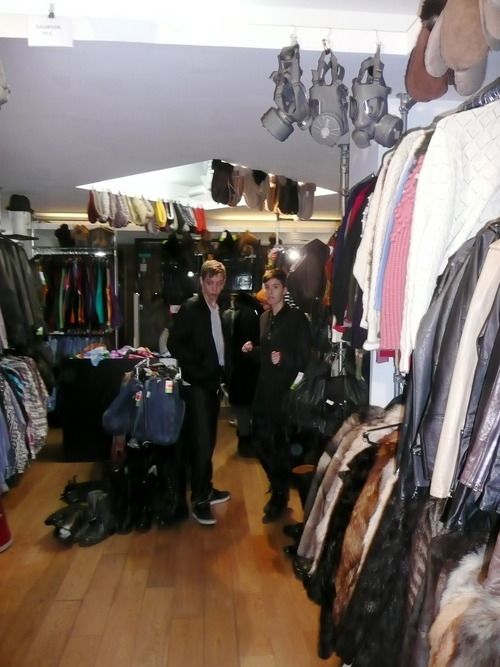
Find the location of a particular element. Image resolution: width=500 pixels, height=667 pixels. furs or faux fur is located at coordinates (480, 620).